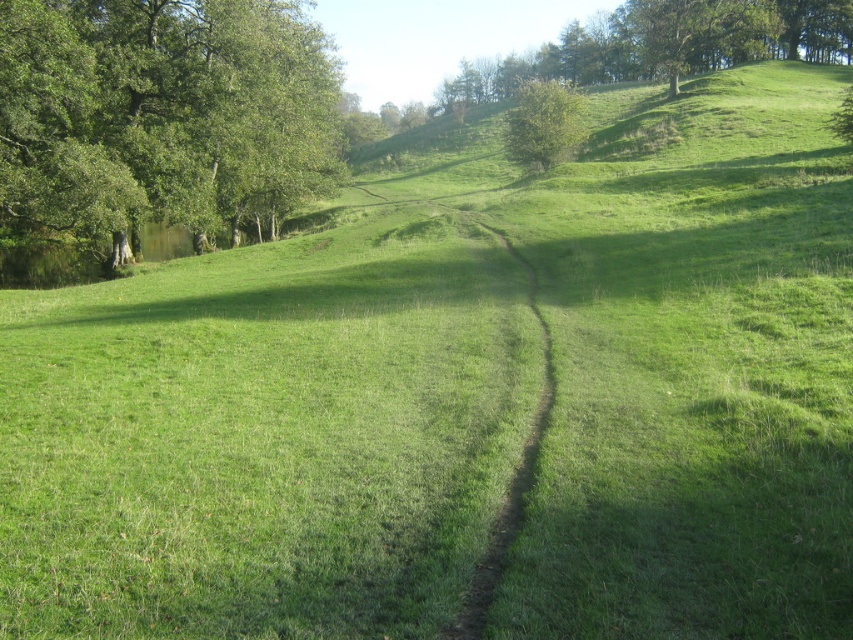
Can you confirm if green leafy tree at left is wider than green leafy tree at upper center?

No.

Does green leafy tree at left appear on the right side of green leafy tree at upper center?

Incorrect, green leafy tree at left is not on the right side of green leafy tree at upper center.

Is point (316, 51) positioned behind point (569, 156)?

No, it is in front of (569, 156).

This screenshot has height=640, width=853. What are the coordinates of `green leafy tree at left` in the screenshot? It's located at (163, 113).